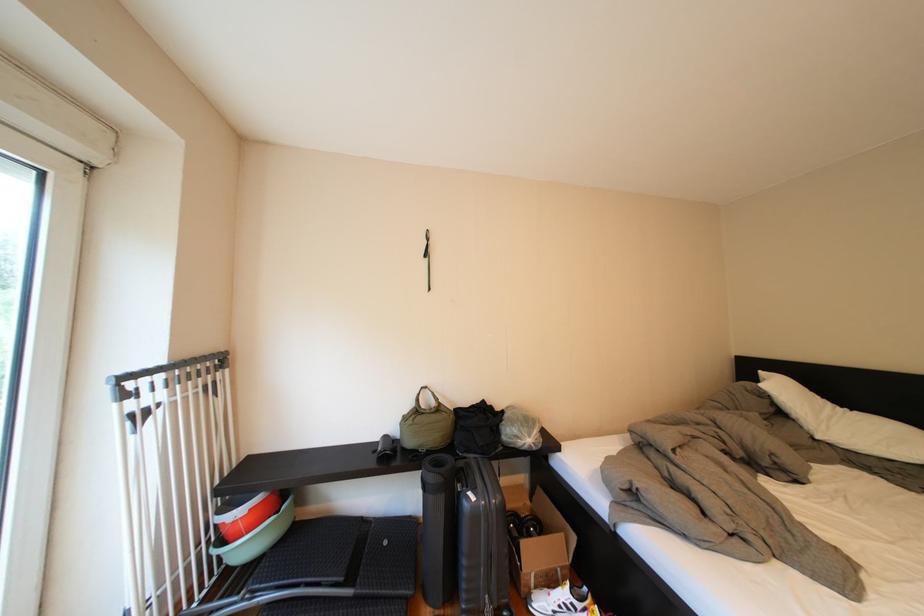
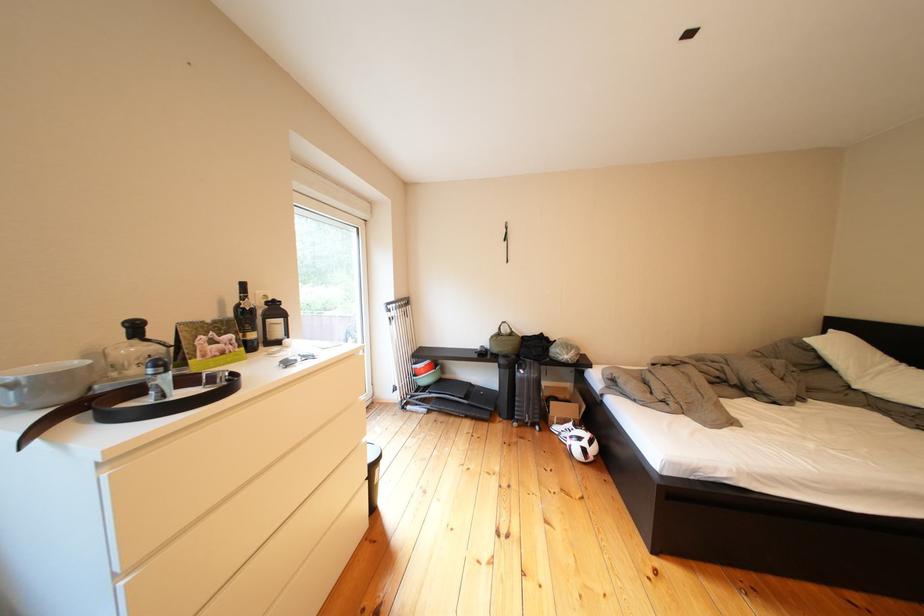
The point at (444,480) is marked in the first image. Where is the corresponding point in the second image?

(516, 366)